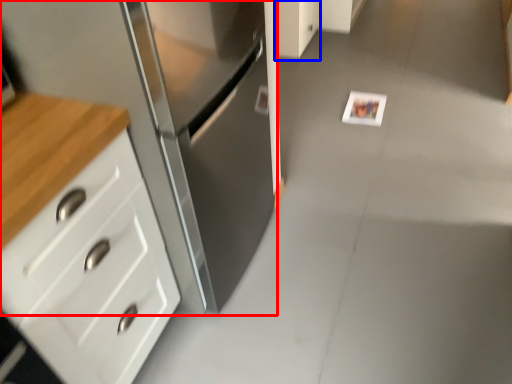
Question: Among these objects, which one is farthest to the camera, cabinetry (highlighted by a red box) or cabinetry (highlighted by a blue box)?

Choices:
 (A) cabinetry
 (B) cabinetry

Answer: (B)